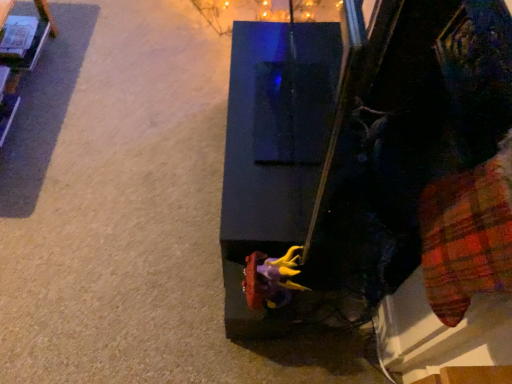
Where is `wooden bookshelf at upper left`? The width and height of the screenshot is (512, 384). wooden bookshelf at upper left is located at coordinates (19, 54).

Image resolution: width=512 pixels, height=384 pixels. Describe the element at coordinates (19, 54) in the screenshot. I see `wooden bookshelf at upper left` at that location.

Identify the location of wooden bookshelf at upper left. (19, 54).